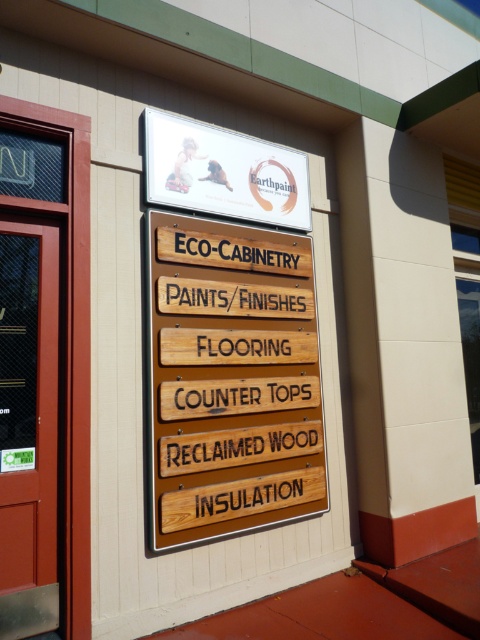
Question: Which point is closer to the camera?

Choices:
 (A) wooden sign at center
 (B) matte glass door at left

Answer: (B)

Question: Which point is closer to the camera?

Choices:
 (A) (159, 355)
 (B) (69, 557)

Answer: (B)

Question: Which of these objects is positioned farthest from the matte glass door at left?

Choices:
 (A) wooden sign at center
 (B) white matte sign at upper center

Answer: (B)

Question: Considering the relative positions of wooden sign at center and white matte sign at upper center in the image provided, where is wooden sign at center located with respect to white matte sign at upper center?

Choices:
 (A) right
 (B) left

Answer: (A)

Question: Can you confirm if wooden sign at center is positioned above matte glass door at left?

Choices:
 (A) yes
 (B) no

Answer: (B)

Question: Is matte glass door at left closer to camera compared to white matte sign at upper center?

Choices:
 (A) yes
 (B) no

Answer: (A)